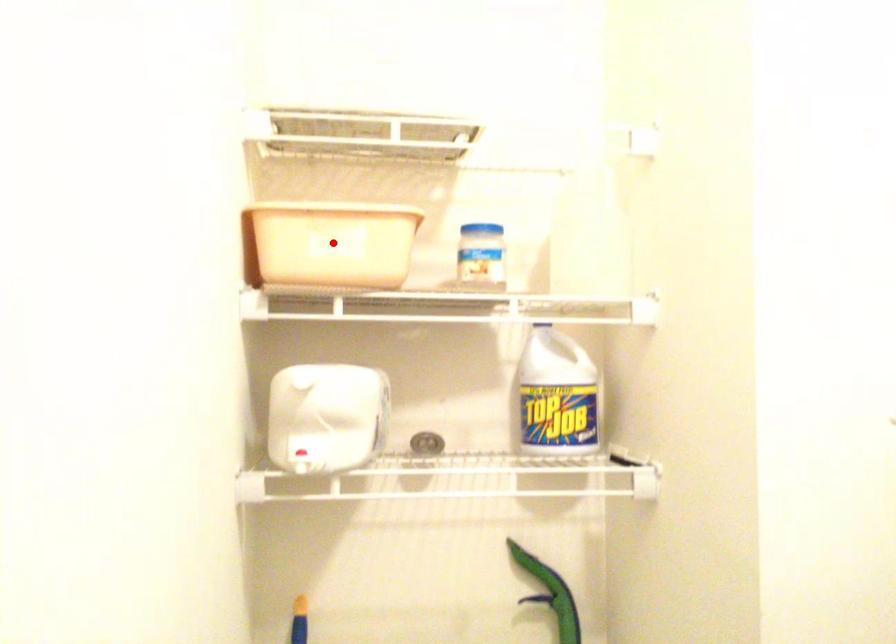
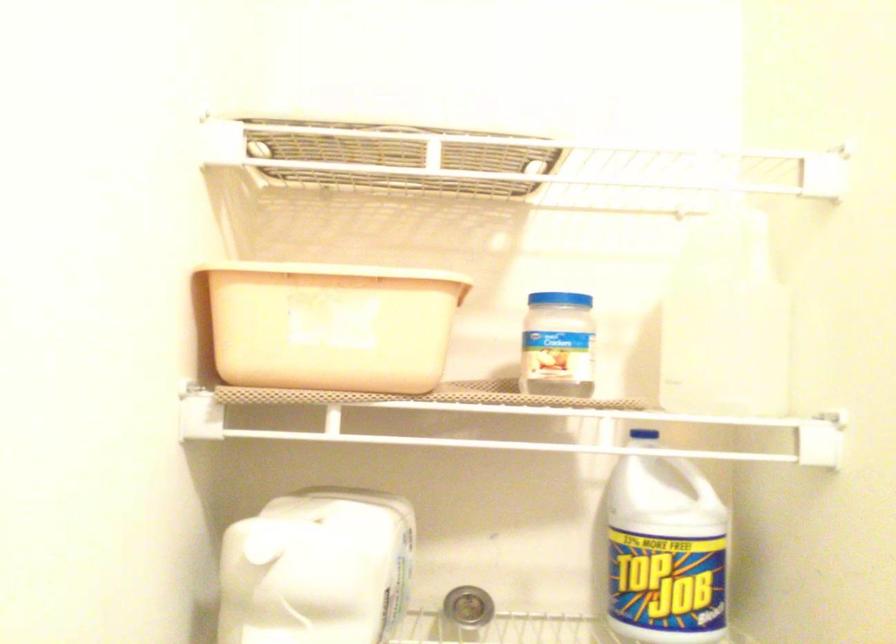
In the second image, find the point that corresponds to the highlighted location in the first image.

(330, 325)